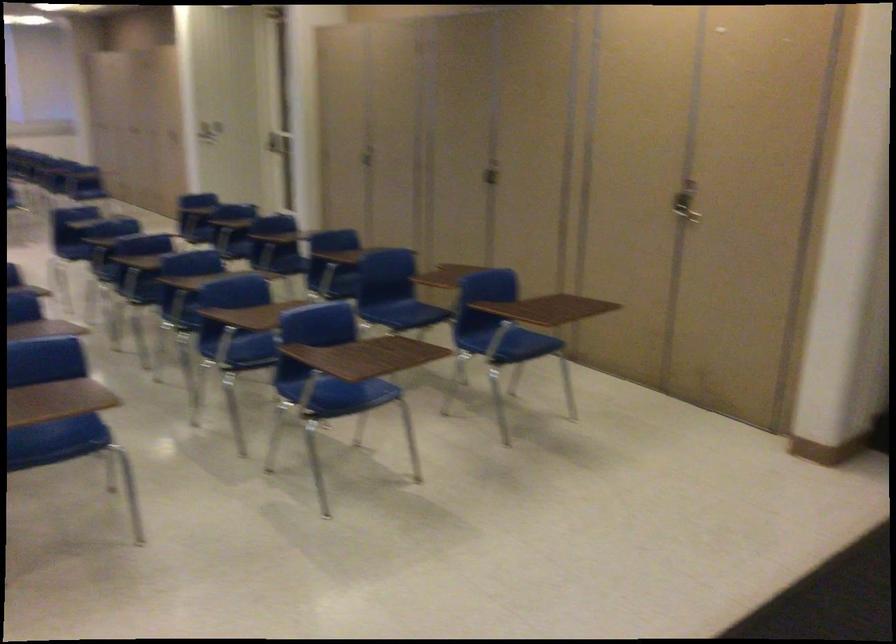
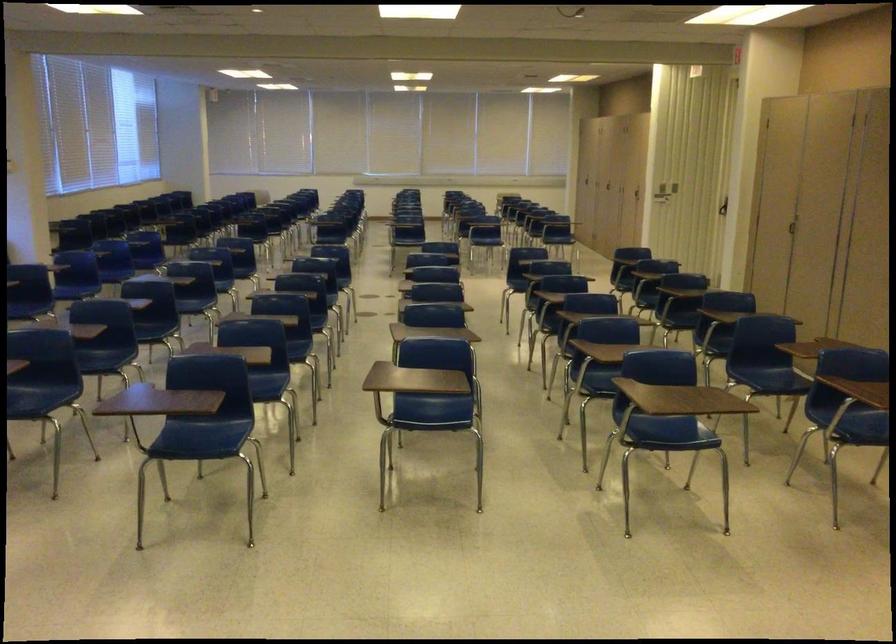
In the second image, find the point that corresponds to point 367,158 in the first image.

(794, 228)